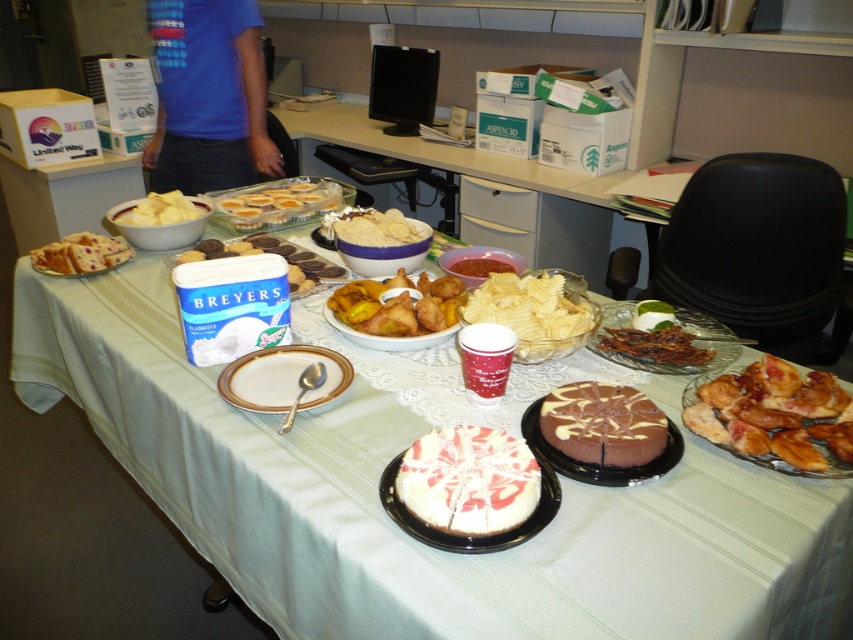
You are planning to place a new dessert on the table where the white lace tablecloth at center is. Considering the white matte bowl at upper left is already there, which object has more space available for placing items?

The white lace tablecloth at center has a larger size compared to the white matte bowl at upper left, so it has more space available for placing items.

You are a guest at the event and want to grab both the chocolate cake at center and the white cake with red swirls on black plate. The distance between them is 35.38 inches. If you can only reach 30 inches, can you reach both without moving?

The distance between the chocolate cake at center and the white cake with red swirls on black plate is 35.38 inches, which is greater than your reach of 30 inches. Therefore, you cannot reach both without moving.